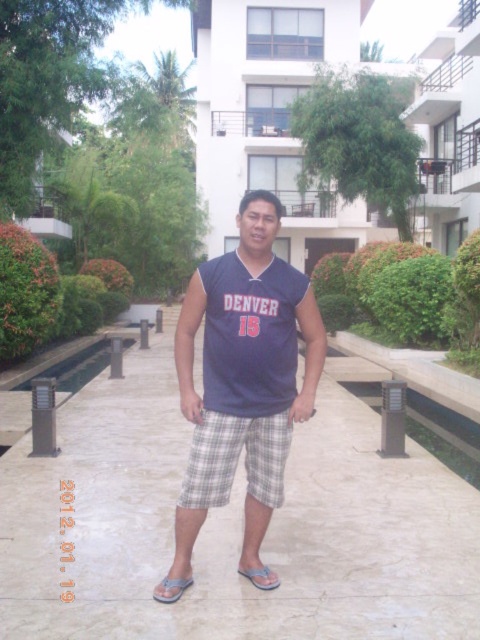
Between gray plaid shorts at center and light blue fabric sandal at lower center, which one appears on the right side from the viewer's perspective?

gray plaid shorts at center

Measure the distance between gray plaid shorts at center and light blue fabric sandal at lower center.

The distance of gray plaid shorts at center from light blue fabric sandal at lower center is 23.78 inches.

Where is `gray plaid shorts at center`? gray plaid shorts at center is located at coordinates (236, 460).

Can you confirm if navy blue jersey at center is bigger than gray fabric sandal at lower center?

Indeed, navy blue jersey at center has a larger size compared to gray fabric sandal at lower center.

In the scene shown: Can you confirm if navy blue jersey at center is wider than gray fabric sandal at lower center?

Yes, navy blue jersey at center is wider than gray fabric sandal at lower center.

Who is more distant from viewer, (215, 433) or (243, 572)?

The point (243, 572) is behind.

This screenshot has height=640, width=480. What are the coordinates of `navy blue jersey at center` in the screenshot? It's located at (243, 378).

Is navy blue jersey at center below gray plaid shorts at center?

Incorrect, navy blue jersey at center is not positioned below gray plaid shorts at center.

Which is more to the left, navy blue jersey at center or gray plaid shorts at center?

From the viewer's perspective, gray plaid shorts at center appears more on the left side.

Locate an element on the screen. navy blue jersey at center is located at coordinates (243, 378).